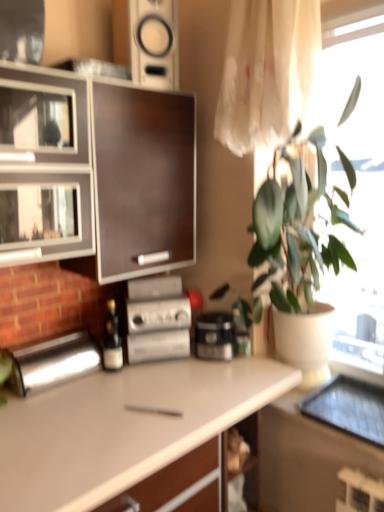
Locate an element on the screen. The height and width of the screenshot is (512, 384). spots to the right of black plastic coffee maker at center is located at coordinates (262, 362).